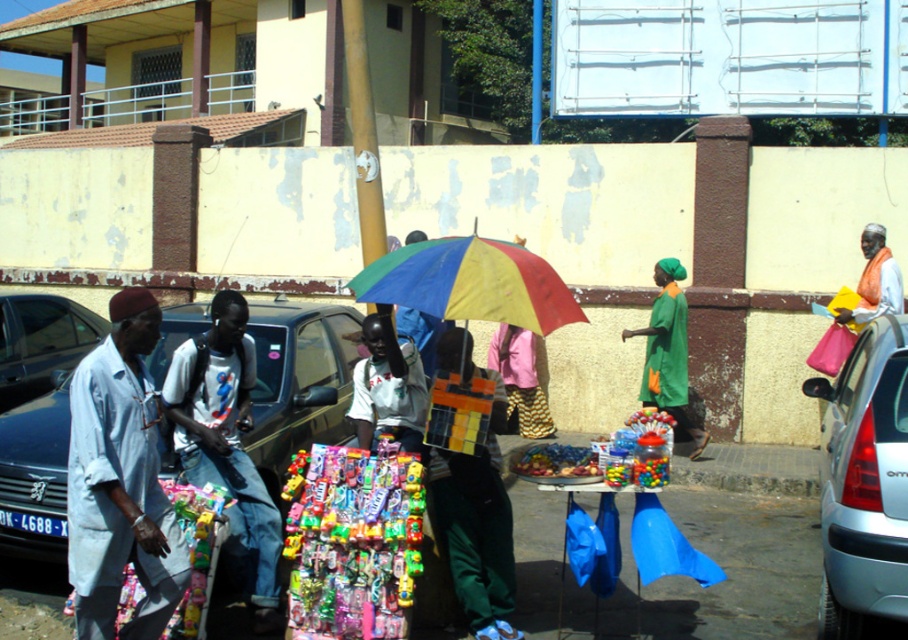
Question: Is light blue fabric shirt at left to the left of silver metallic car at right from the viewer's perspective?

Choices:
 (A) no
 (B) yes

Answer: (B)

Question: Which of the following is the closest to the observer?

Choices:
 (A) (873, 408)
 (B) (214, 404)

Answer: (A)

Question: Does light blue fabric shirt at left appear under rainbow fabric umbrella at center?

Choices:
 (A) yes
 (B) no

Answer: (A)

Question: Among these objects, which one is nearest to the camera?

Choices:
 (A) white matte t-shirt at center
 (B) shiny black car at left
 (C) silver metallic car at right

Answer: (C)

Question: Does shiny plastic candy at center appear on the left side of rainbow fabric umbrella at center?

Choices:
 (A) yes
 (B) no

Answer: (A)

Question: Which of the following is the closest to the observer?

Choices:
 (A) blue metallic car at left
 (B) light blue fabric shirt at left
 (C) white matte t-shirt at center
 (D) silver metallic car at right

Answer: (B)